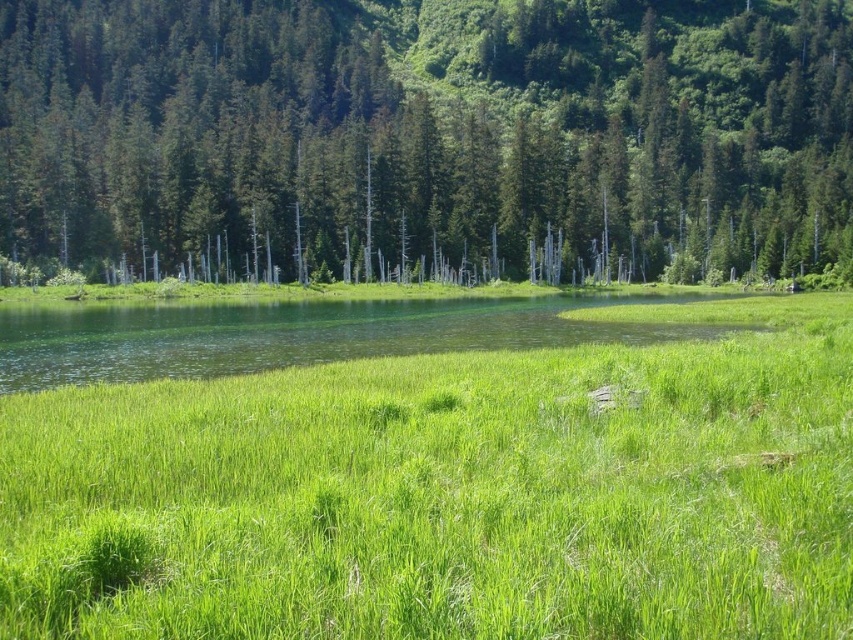
Between green grassy at center and clear water at center, which one has less height?

With less height is green grassy at center.

Can you confirm if green grassy at center is positioned above clear water at center?

Incorrect, green grassy at center is not positioned above clear water at center.

The image size is (853, 640). Find the location of `green grassy at center`. green grassy at center is located at coordinates (450, 493).

Can you confirm if green grassy at center is wider than green matte tree at center?

Incorrect, green grassy at center's width does not surpass green matte tree at center's.

Between green grassy at center and green matte tree at center, which one is positioned lower?

Positioned lower is green grassy at center.

Who is more forward, (793,628) or (451,116)?

Positioned in front is point (793,628).

I want to click on green grassy at center, so click(450, 493).

Can you confirm if green matte tree at center is smaller than clear water at center?

Actually, green matte tree at center might be larger than clear water at center.

Based on the photo, does green matte tree at center have a greater width compared to clear water at center?

Yes.

Who is more distant from viewer, (480,3) or (374,330)?

The point (480,3) is more distant.

The height and width of the screenshot is (640, 853). I want to click on green matte tree at center, so click(427, 134).